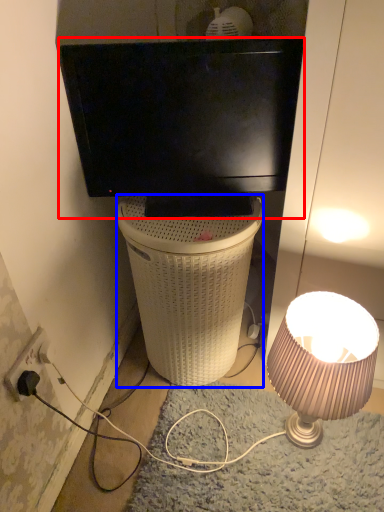
Question: Which object appears farthest to the camera in this image, television (highlighted by a red box) or trash bin/can (highlighted by a blue box)?

Choices:
 (A) television
 (B) trash bin/can

Answer: (B)